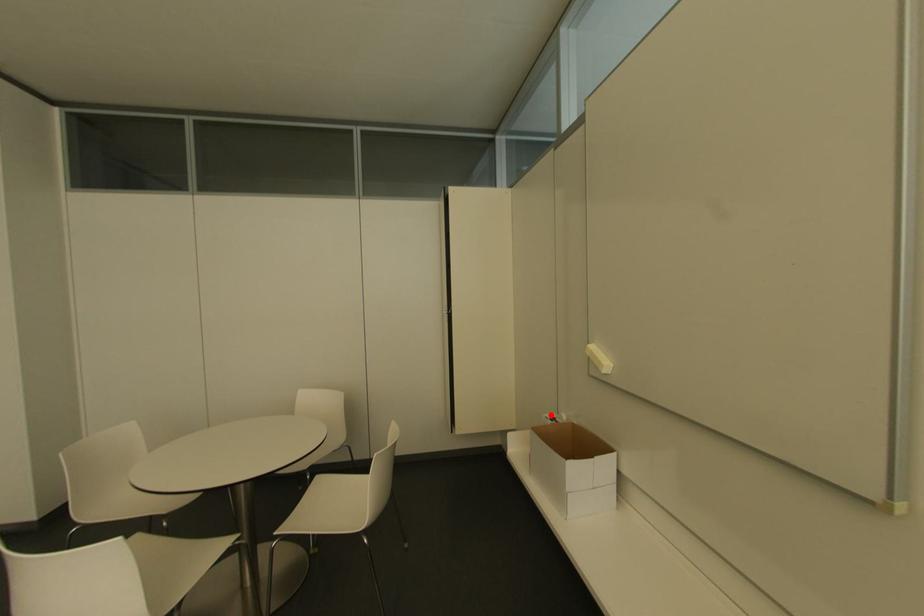
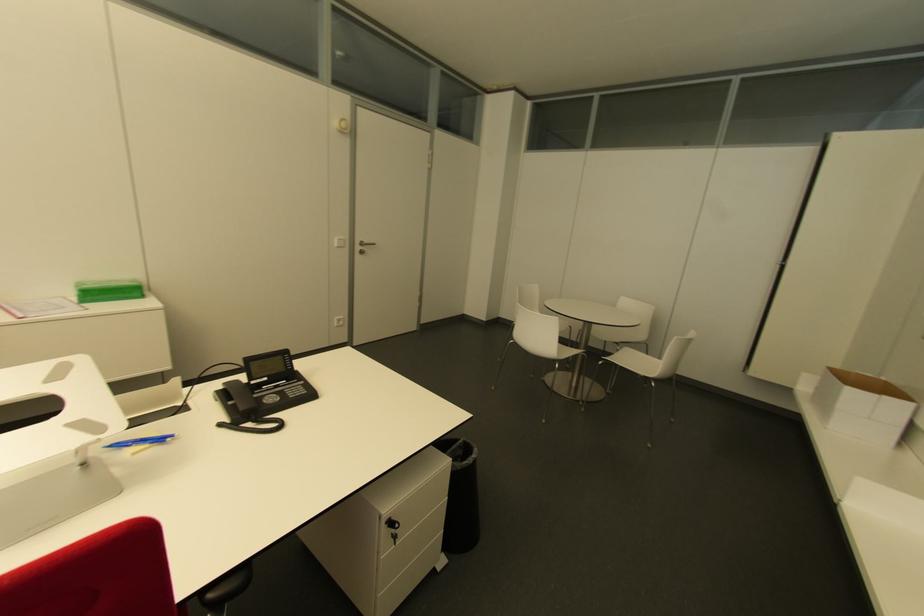
Where in the second image is the point corresponding to the highlighted location from the first image?

(868, 376)